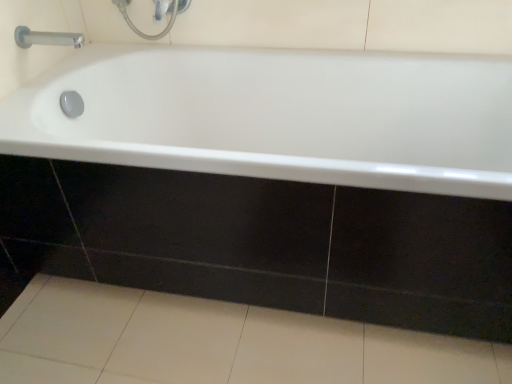
Find the location of a particular element. The image size is (512, 384). free location above white glossy tile at lower center (from a real-world perspective) is located at coordinates (207, 344).